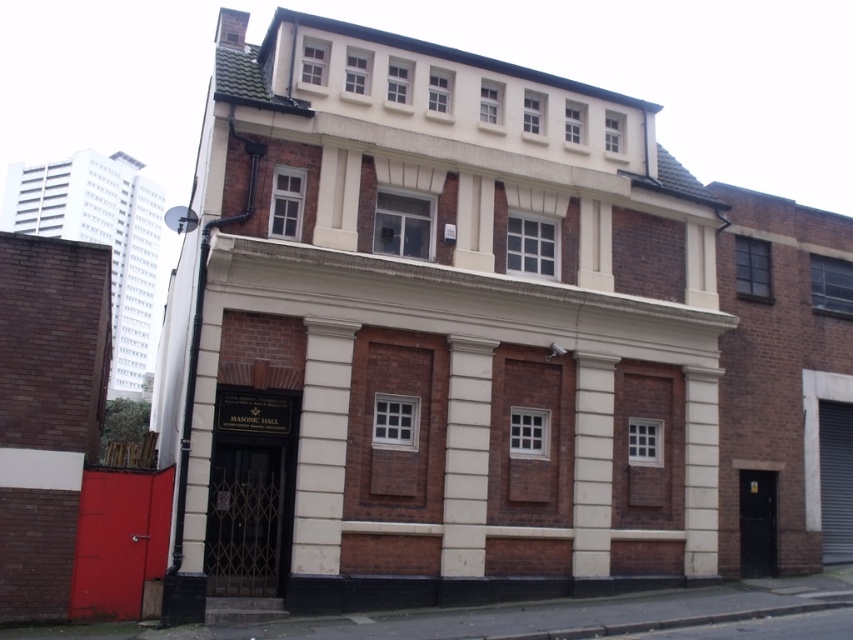
You are standing at the entrance of the Masonic Hall and want to walk towards the point marked as point (705, 392). However, there is an obstacle at point (469, 465). Will you encounter this obstacle before reaching your destination?

Yes, you will encounter the obstacle at point (469, 465) before reaching point (705, 392) because point (469, 465) is in front of point (705, 392).

You are standing at the entrance of the Masonic Hall and see the white smooth column at center and the smooth white column at center. How far apart are these two columns?

The white smooth column at center is 7.43 feet away from the smooth white column at center.